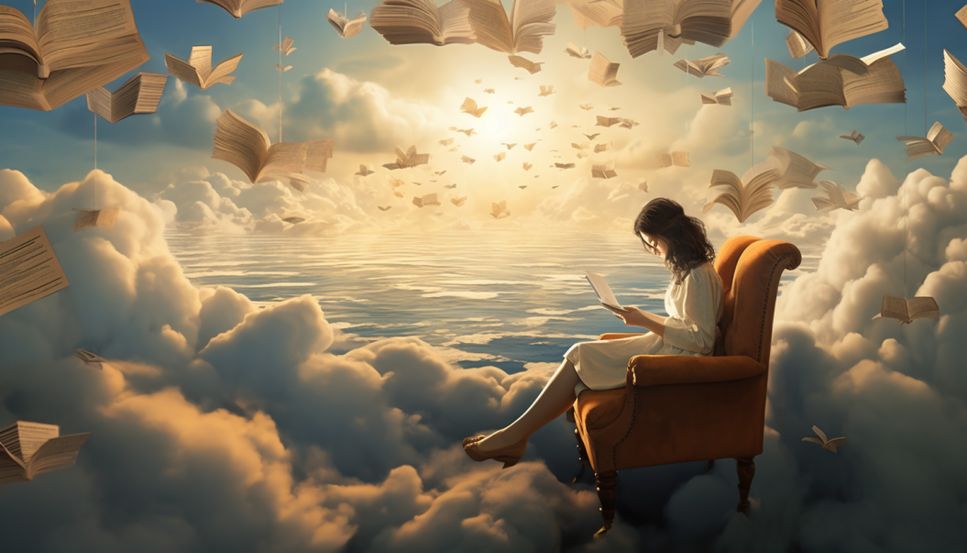
In order to click on chair in this screenshot , I will do `click(670, 438)`.